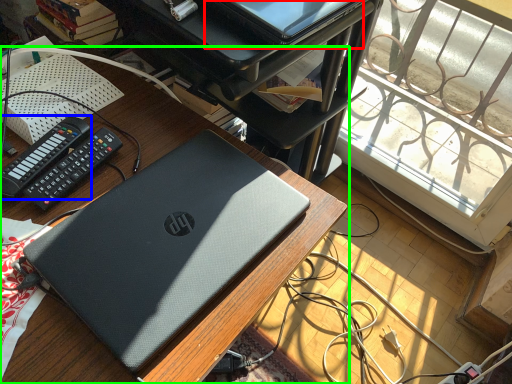
Question: Estimate the real-world distances between objects in this image. Which object is farther from computer (highlighted by a red box), control (highlighted by a blue box) or desk (highlighted by a green box)?

Choices:
 (A) control
 (B) desk

Answer: (A)